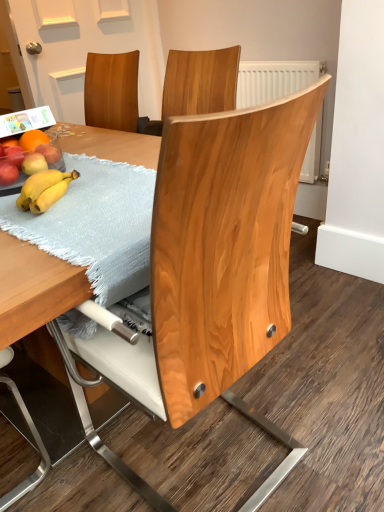
Question: Is light blue textured placemat at table to the right of matte red apple at left, the fourth apple when ordered from front to back, from the viewer's perspective?

Choices:
 (A) yes
 (B) no

Answer: (A)

Question: Is light blue textured placemat at table closer to the viewer compared to matte red apple at left, marked as the first apple in a back-to-front arrangement?

Choices:
 (A) no
 (B) yes

Answer: (B)

Question: Are light blue textured placemat at table and matte red apple at left, the fourth apple when ordered from front to back, far apart?

Choices:
 (A) no
 (B) yes

Answer: (A)

Question: Is light blue textured placemat at table wider than matte red apple at left, marked as the first apple in a back-to-front arrangement?

Choices:
 (A) yes
 (B) no

Answer: (A)

Question: Are light blue textured placemat at table and matte red apple at left, the fourth apple when ordered from front to back, making contact?

Choices:
 (A) yes
 (B) no

Answer: (B)

Question: Considering the positions of matte red apple at left, arranged as the 3th apple when viewed from the front, and yellow matte apple at left, arranged as the second apple when viewed from the front, in the image, is matte red apple at left, arranged as the 3th apple when viewed from the front, taller or shorter than yellow matte apple at left, arranged as the second apple when viewed from the front,?

Choices:
 (A) short
 (B) tall

Answer: (A)

Question: Is matte red apple at left, which ranks as the 2th apple in back-to-front order, wider or thinner than yellow matte apple at left, arranged as the 3th apple when viewed from the back?

Choices:
 (A) thin
 (B) wide

Answer: (B)

Question: In the image, is matte red apple at left, which ranks as the 2th apple in back-to-front order, on the left side or the right side of yellow matte apple at left, arranged as the second apple when viewed from the front?

Choices:
 (A) left
 (B) right

Answer: (A)

Question: From a real-world perspective, is matte red apple at left, which ranks as the 2th apple in back-to-front order, positioned above or below yellow matte apple at left, arranged as the 3th apple when viewed from the back?

Choices:
 (A) above
 (B) below

Answer: (A)

Question: From the image's perspective, is matte red apple at left, which ranks as the 2th apple in back-to-front order, located above or below natural wood chair at center?

Choices:
 (A) above
 (B) below

Answer: (A)

Question: Which is correct: matte red apple at left, arranged as the 3th apple when viewed from the front, is inside natural wood chair at center, or outside of it?

Choices:
 (A) outside
 (B) inside

Answer: (A)

Question: Considering the positions of point (16, 147) and point (198, 270), is point (16, 147) closer or farther from the camera than point (198, 270)?

Choices:
 (A) farther
 (B) closer

Answer: (A)

Question: Looking at their shapes, would you say matte red apple at left, which ranks as the 2th apple in back-to-front order, is wider or thinner than natural wood chair at center?

Choices:
 (A) wide
 (B) thin

Answer: (B)

Question: In terms of height, does matte red apple at left, arranged as the fourth apple when viewed from the back, look taller or shorter compared to natural wood chair at center?

Choices:
 (A) short
 (B) tall

Answer: (A)

Question: Is matte red apple at left, arranged as the fourth apple when viewed from the back, wider or thinner than natural wood chair at center?

Choices:
 (A) wide
 (B) thin

Answer: (B)